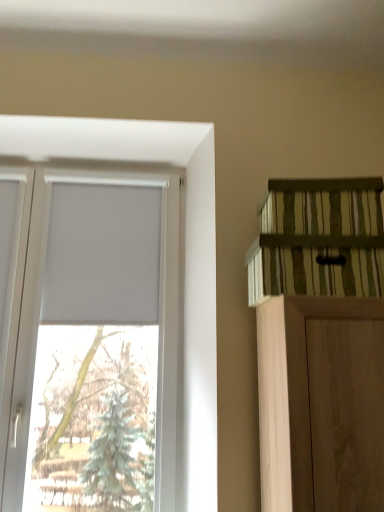
Question: Choose the correct answer: Is white matte window at upper left inside green striped wood shelf at upper right or outside it?

Choices:
 (A) inside
 (B) outside

Answer: (B)

Question: From a real-world perspective, is white matte window at upper left physically located above or below green striped wood shelf at upper right?

Choices:
 (A) above
 (B) below

Answer: (B)

Question: Considering the positions of white matte window at upper left and green striped wood shelf at upper right in the image, is white matte window at upper left taller or shorter than green striped wood shelf at upper right?

Choices:
 (A) tall
 (B) short

Answer: (A)

Question: In terms of height, does green striped wood shelf at upper right look taller or shorter compared to white matte window at upper left?

Choices:
 (A) tall
 (B) short

Answer: (B)

Question: Visually, is green striped wood shelf at upper right positioned to the left or to the right of white matte window at upper left?

Choices:
 (A) left
 (B) right

Answer: (B)

Question: From a real-world perspective, relative to white matte window at upper left, is green striped wood shelf at upper right vertically above or below?

Choices:
 (A) above
 (B) below

Answer: (A)

Question: Is green striped wood shelf at upper right in front of or behind white matte window at upper left in the image?

Choices:
 (A) front
 (B) behind

Answer: (A)